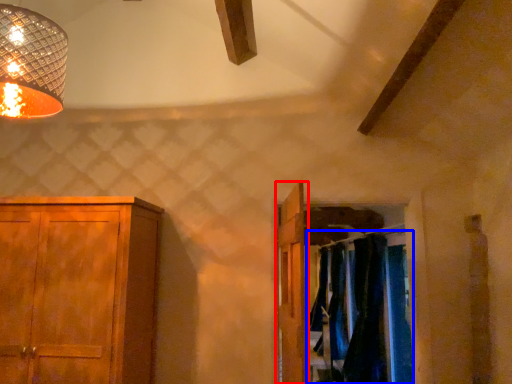
Question: Which object is closer to the camera taking this photo, door (highlighted by a red box) or laundry (highlighted by a blue box)?

Choices:
 (A) door
 (B) laundry

Answer: (A)